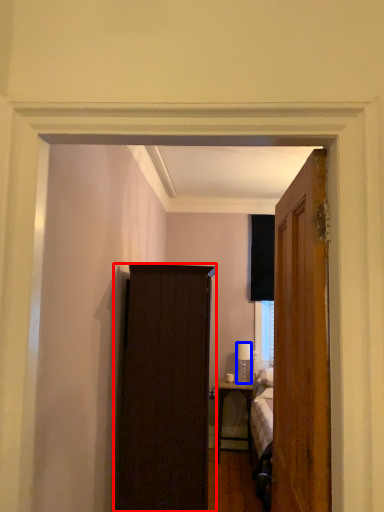
Question: Among these objects, which one is nearest to the camera, cabinetry (highlighted by a red box) or lamp (highlighted by a blue box)?

Choices:
 (A) cabinetry
 (B) lamp

Answer: (A)